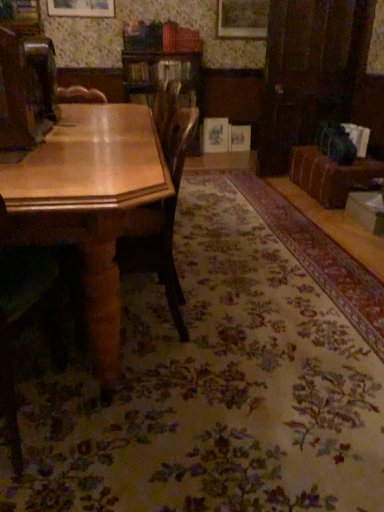
Find the location of `vacant region to the right of wooden chair at left, acting as the 1th chair starting from the left`. vacant region to the right of wooden chair at left, acting as the 1th chair starting from the left is located at coordinates (134, 425).